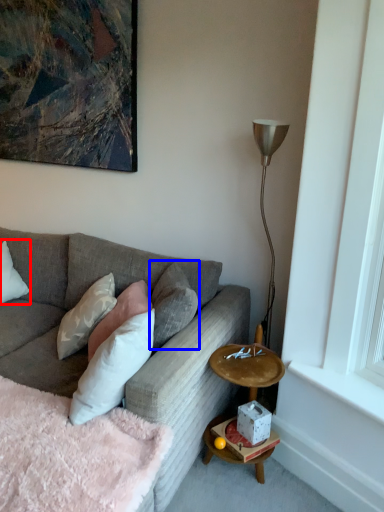
Question: Which object is further to the camera taking this photo, pillow (highlighted by a red box) or pillow (highlighted by a blue box)?

Choices:
 (A) pillow
 (B) pillow

Answer: (A)